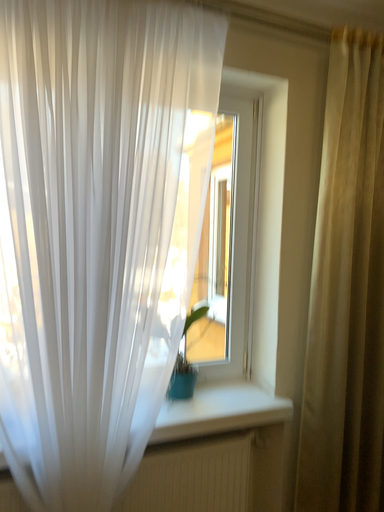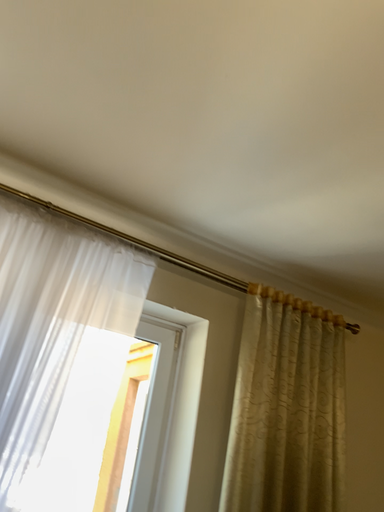
Question: How did the camera likely rotate when shooting the video?

Choices:
 (A) rotated right
 (B) rotated left

Answer: (A)